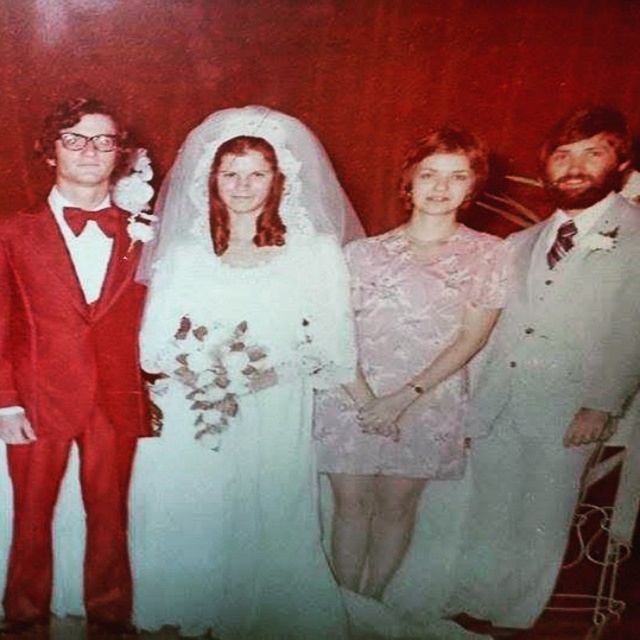
Measure the distance between point (124,250) and camera.

A distance of 8.77 feet exists between point (124,250) and camera.

Is shiny red suit at left bigger than pink lace dress at center?

Incorrect, shiny red suit at left is not larger than pink lace dress at center.

Does point (108, 605) come in front of point (444, 330)?

No, (108, 605) is further to viewer.

The image size is (640, 640). In order to click on shiny red suit at left in this screenshot , I will do `click(70, 371)`.

Is white satin dress at center above pink lace dress at center?

Incorrect, white satin dress at center is not positioned above pink lace dress at center.

Who is taller, white satin dress at center or pink lace dress at center?

With more height is white satin dress at center.

Describe the element at coordinates (241, 381) in the screenshot. I see `white satin dress at center` at that location.

What are the coordinates of `white satin dress at center` in the screenshot? It's located at (241, 381).

Is white satin dress at center shorter than light blue satin suit at right?

Correct, white satin dress at center is not as tall as light blue satin suit at right.

Locate an element on the screen. white satin dress at center is located at coordinates (241, 381).